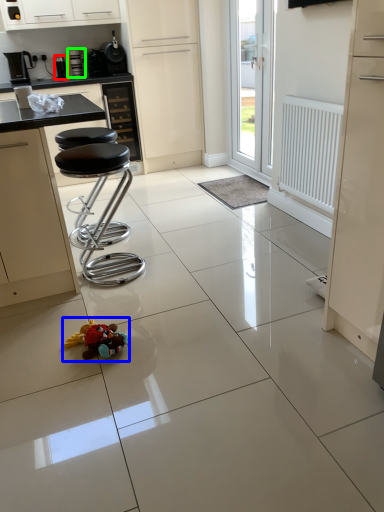
Question: Considering the real-world distances, which object is farthest from appliance (highlighted by a red box)? toy (highlighted by a blue box) or coffee machine (highlighted by a green box)?

Choices:
 (A) toy
 (B) coffee machine

Answer: (A)